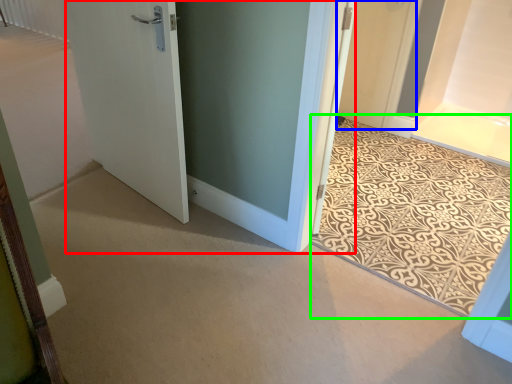
Question: Considering the real-world distances, which object is closest to door (highlighted by a red box)? door (highlighted by a blue box) or doormat (highlighted by a green box).

Choices:
 (A) door
 (B) doormat

Answer: (B)